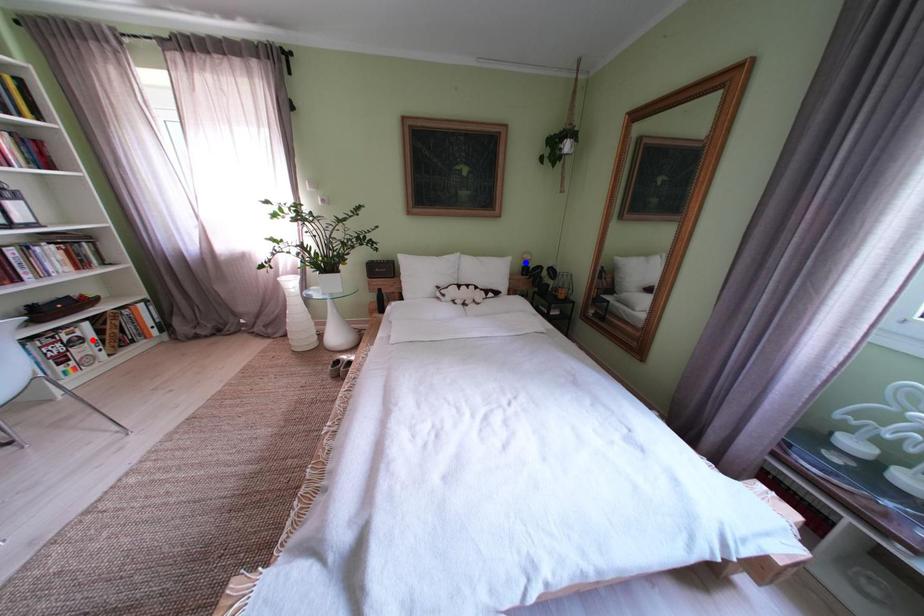
Question: Which of the two points in the image is closer to the camera?

Choices:
 (A) Blue point is closer.
 (B) Red point is closer.

Answer: (B)